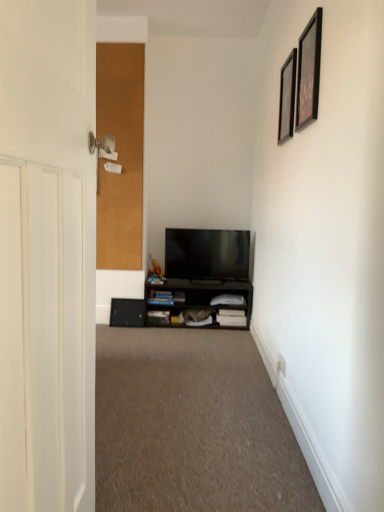
Question: Is the depth of carpet at center greater than that of black matte cabinet at lower center?

Choices:
 (A) yes
 (B) no

Answer: (B)

Question: Is carpet at center smaller than black matte cabinet at lower center?

Choices:
 (A) yes
 (B) no

Answer: (A)

Question: Is carpet at center to the right of black matte cabinet at lower center from the viewer's perspective?

Choices:
 (A) yes
 (B) no

Answer: (B)

Question: From the image's perspective, does carpet at center appear lower than black matte cabinet at lower center?

Choices:
 (A) no
 (B) yes

Answer: (B)

Question: Is carpet at center aimed at black matte cabinet at lower center?

Choices:
 (A) no
 (B) yes

Answer: (A)

Question: Is flat screen tv at center bigger or smaller than black matte cabinet at lower center?

Choices:
 (A) big
 (B) small

Answer: (B)

Question: From their relative heights in the image, would you say flat screen tv at center is taller or shorter than black matte cabinet at lower center?

Choices:
 (A) tall
 (B) short

Answer: (A)

Question: Is point (238, 266) closer or farther from the camera than point (190, 308)?

Choices:
 (A) farther
 (B) closer

Answer: (B)

Question: In the image, is flat screen tv at center on the left side or the right side of black matte cabinet at lower center?

Choices:
 (A) left
 (B) right

Answer: (B)

Question: From the image's perspective, is black matte picture frame at upper right, the 2th picture frame viewed from the front, above or below black matte cabinet at lower center?

Choices:
 (A) above
 (B) below

Answer: (A)

Question: Is point (289, 56) closer or farther from the camera than point (147, 304)?

Choices:
 (A) farther
 (B) closer

Answer: (B)

Question: From their relative heights in the image, would you say black matte picture frame at upper right, which is the first picture frame from back to front, is taller or shorter than black matte cabinet at lower center?

Choices:
 (A) short
 (B) tall

Answer: (B)

Question: Considering the relative positions of black matte picture frame at upper right, which is the first picture frame from back to front, and black matte cabinet at lower center in the image provided, is black matte picture frame at upper right, which is the first picture frame from back to front, to the left or to the right of black matte cabinet at lower center?

Choices:
 (A) right
 (B) left

Answer: (A)

Question: From their relative heights in the image, would you say white wooden door at left, which is the first door from right to left, is taller or shorter than black glossy picture frame at upper right, the 2th picture frame when ordered from back to front?

Choices:
 (A) tall
 (B) short

Answer: (A)

Question: Based on their positions, is white wooden door at left, marked as the second door in a left-to-right arrangement, located to the left or right of black glossy picture frame at upper right, acting as the first picture frame starting from the front?

Choices:
 (A) right
 (B) left

Answer: (B)